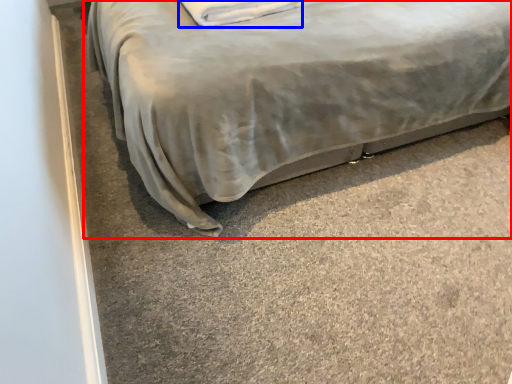
Question: Which point is further to the camera, bed (highlighted by a red box) or pillow (highlighted by a blue box)?

Choices:
 (A) bed
 (B) pillow

Answer: (B)